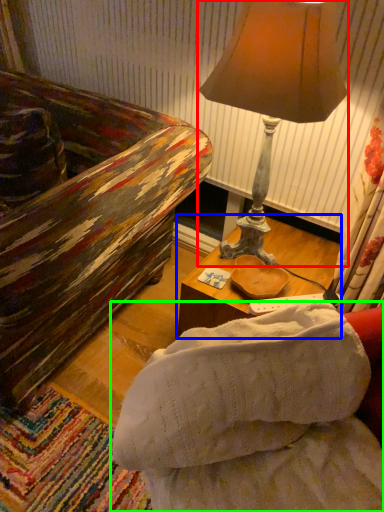
Question: Based on their relative distances, which object is nearer to lamp (highlighted by a red box)? Choose from table (highlighted by a blue box) and studio couch (highlighted by a green box).

Choices:
 (A) table
 (B) studio couch

Answer: (A)